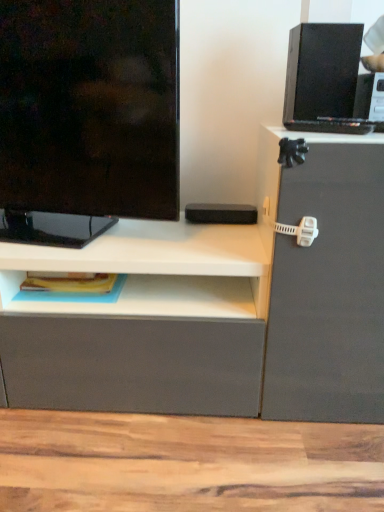
What do you see at coordinates (325, 80) in the screenshot?
I see `black matte speaker at upper right` at bounding box center [325, 80].

Identify the location of black matte speaker at upper right. The image size is (384, 512). (325, 80).

Find the location of a particular element. The height and width of the screenshot is (512, 384). matte black television at left is located at coordinates (87, 116).

What is the approximate height of matte black television at left?

20.75 inches.

Describe the element at coordinates (87, 116) in the screenshot. The image size is (384, 512). I see `matte black television at left` at that location.

Identify the location of black matte speaker at upper right. click(325, 80).

Which is more to the left, black matte speaker at upper right or matte black television at left?

matte black television at left is more to the left.

Which object is further away from the camera taking this photo, black matte speaker at upper right or matte black television at left?

black matte speaker at upper right.

Does point (342, 41) appear closer or farther from the camera than point (66, 162)?

Point (342, 41) is positioned closer to the camera compared to point (66, 162).

From the image's perspective, is black matte speaker at upper right over matte black television at left?

Indeed, from the image's perspective, black matte speaker at upper right is shown above matte black television at left.

From a real-world perspective, which object rests below the other?

In real-world perspective, matte black television at left is lower.

Is black matte speaker at upper right wider than matte black television at left?

Yes.

Is black matte speaker at upper right shorter than matte black television at left?

Yes, black matte speaker at upper right is shorter than matte black television at left.

Between black matte speaker at upper right and matte black television at left, which one has smaller size?

black matte speaker at upper right.

Would you say black matte speaker at upper right contains matte black television at left?

Actually, matte black television at left is outside black matte speaker at upper right.

Is black matte speaker at upper right with matte black television at left?

black matte speaker at upper right and matte black television at left are clearly separated.

Does black matte speaker at upper right turn towards matte black television at left?

No, black matte speaker at upper right is not facing towards matte black television at left.

Identify the location of television that appears below the black matte speaker at upper right (from the image's perspective). (87, 116).

Is matte black television at left to the right of black matte speaker at upper right from the viewer's perspective?

No, matte black television at left is not to the right of black matte speaker at upper right.

Which is in front, matte black television at left or black matte speaker at upper right?

matte black television at left.

Which point is more distant from viewer, [160,118] or [302,111]?

Point [302,111]

From the image's perspective, relative to black matte speaker at upper right, is matte black television at left above or below?

Clearly, from the image's perspective, matte black television at left is below black matte speaker at upper right.

From a real-world perspective, is matte black television at left above or below black matte speaker at upper right?

In terms of real-world spatial position, matte black television at left is below black matte speaker at upper right.

Considering the relative sizes of matte black television at left and black matte speaker at upper right in the image provided, is matte black television at left thinner than black matte speaker at upper right?

Yes.

Does matte black television at left have a lesser height compared to black matte speaker at upper right?

No.

Which of these two, matte black television at left or black matte speaker at upper right, is smaller?

With smaller size is black matte speaker at upper right.

Does matte black television at left contain black matte speaker at upper right?

No, black matte speaker at upper right is not inside matte black television at left.

Is matte black television at left next to black matte speaker at upper right and touching it?

matte black television at left is not next to black matte speaker at upper right, and they're not touching.

Is matte black television at left positioned with its back to black matte speaker at upper right?

matte black television at left does not have its back to black matte speaker at upper right.

What's the angular difference between matte black television at left and black matte speaker at upper right's facing directions?

11.6 degrees.

The height and width of the screenshot is (512, 384). I want to click on computer on the right of matte black television at left, so click(325, 80).

Locate an element on the screen. computer lying on the right of matte black television at left is located at coordinates (325, 80).

Find the location of a particular element. The width and height of the screenshot is (384, 512). computer above the matte black television at left (from a real-world perspective) is located at coordinates point(325,80).